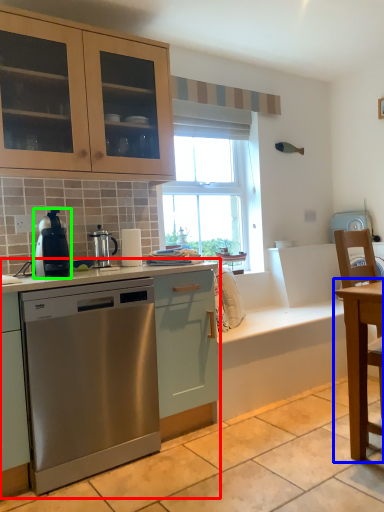
Question: Which is nearer to the cabinetry (highlighted by a red box)? table (highlighted by a blue box) or home appliance (highlighted by a green box).

Choices:
 (A) table
 (B) home appliance

Answer: (B)